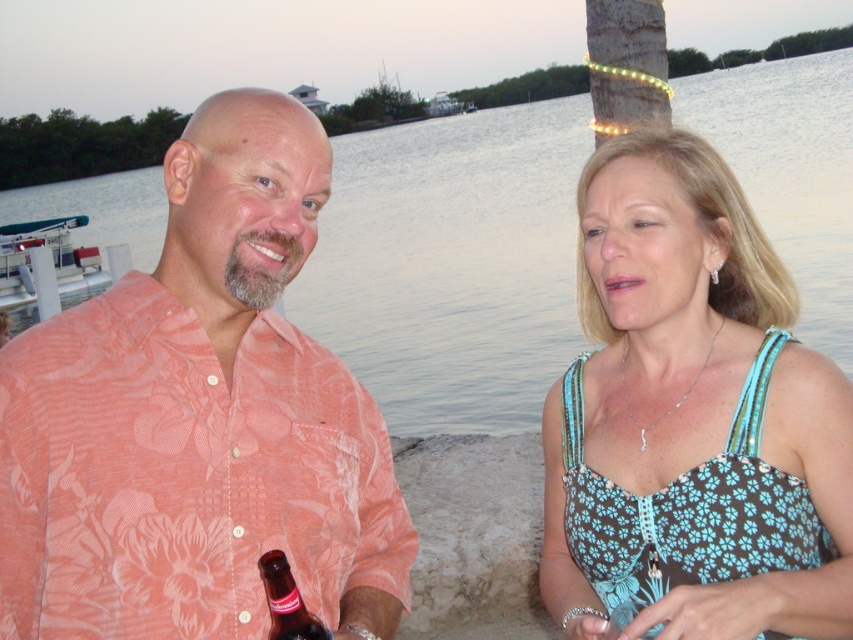
You are a photographer standing at the scene. You want to capture a photo of the blue floral fabric dress at upper right without including any other objects in the frame. Can you do this? Please explain why or why not based on the distance provided.

The blue floral fabric dress at upper right is 5.14 feet away from the camera. Since there are no other objects mentioned in the scene description that are closer than this distance, it is possible to frame the photo to include only the blue floral fabric dress at upper right by adjusting the camera angle or zoom to exclude other elements within the same distance range.

Based on the photo, you are standing at the point marked by coordinates point (691, 417) in the image. Looking around, you see a blue floral fabric dress at upper right. What object is located at this specific coordinate?

The blue floral fabric dress at upper right is located at point (691, 417).